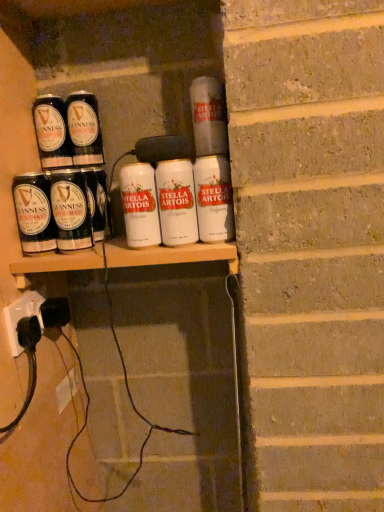
At what (x,y) coordinates should I click in order to perform the action: click on white matte tin can at upper center, the second tin can viewed from the right. Please return your answer as a coordinate pair (x, y). This screenshot has width=384, height=512. Looking at the image, I should click on (208, 116).

What do you see at coordinates (84, 129) in the screenshot?
I see `shiny black can at left, positioned as the 5th tin can in right-to-left order` at bounding box center [84, 129].

Find the location of a particular element. matte black can at left, the 7th tin can viewed from the right is located at coordinates (34, 212).

The height and width of the screenshot is (512, 384). I want to click on white plastic socket at lower left, so click(21, 316).

This screenshot has height=512, width=384. I want to click on white matte stella artois can at center, which is the 6th tin can in left-to-right order, so click(176, 202).

From the picture: Considering the sizes of objects white matte stella artois can at center, which is the 6th tin can in left-to-right order, and white matte tin can at upper center, the second tin can viewed from the right, in the image provided, who is smaller, white matte stella artois can at center, which is the 6th tin can in left-to-right order, or white matte tin can at upper center, the second tin can viewed from the right,?

With smaller size is white matte tin can at upper center, the second tin can viewed from the right.

Is white matte stella artois can at center, which is the 6th tin can in left-to-right order, in contact with white matte tin can at upper center, the second tin can viewed from the right?

white matte stella artois can at center, which is the 6th tin can in left-to-right order, is not next to white matte tin can at upper center, the second tin can viewed from the right, and they're not touching.

Is point (193, 199) closer to viewer compared to point (224, 137)?

That is False.

Is white matte stella artois can at center, which is the 6th tin can in left-to-right order, to the left or to the right of white matte tin can at upper center, the second tin can viewed from the right, in the image?

From the image, it's evident that white matte stella artois can at center, which is the 6th tin can in left-to-right order, is to the left of white matte tin can at upper center, the second tin can viewed from the right.

Does point (144, 166) appear closer or farther from the camera than point (195, 96)?

Point (144, 166) appears to be closer to the viewer than point (195, 96).

Is white matte tin can at center, which ranks as the fourth tin can in right-to-left order, not close to white matte tin can at upper center, the seventh tin can positioned from the left?

Actually, white matte tin can at center, which ranks as the fourth tin can in right-to-left order, and white matte tin can at upper center, the seventh tin can positioned from the left, are a little close together.

From a real-world perspective, who is located lower, white matte tin can at center, the fifth tin can when ordered from left to right, or white matte tin can at upper center, the second tin can viewed from the right?

white matte tin can at center, the fifth tin can when ordered from left to right, from a real-world perspective.

From the image's perspective, who appears lower, white matte tin can at center, which ranks as the fourth tin can in right-to-left order, or white matte tin can at upper center, the seventh tin can positioned from the left?

white matte tin can at center, which ranks as the fourth tin can in right-to-left order, from the image's perspective.

From the image's perspective, which tin can is the 1st one above the white plastic socket at lower left? Please provide its 2D coordinates.

[(34, 212)]

Are white plastic socket at lower left and matte black can at left, the 7th tin can viewed from the right, far apart?

No, white plastic socket at lower left is in close proximity to matte black can at left, the 7th tin can viewed from the right.

Is white plastic socket at lower left at the left side of matte black can at left, the 7th tin can viewed from the right?

Yes, white plastic socket at lower left is to the left of matte black can at left, the 7th tin can viewed from the right.

Is white plastic socket at lower left smaller than matte black can at left, the second tin can in the left-to-right sequence?

Indeed, white plastic socket at lower left has a smaller size compared to matte black can at left, the second tin can in the left-to-right sequence.

What's the angular difference between white matte tin can at upper center, the second tin can viewed from the right, and white matte tin can at center, which ranks as the fourth tin can in right-to-left order,'s facing directions?

0.000648 degrees separate the facing orientations of white matte tin can at upper center, the second tin can viewed from the right, and white matte tin can at center, which ranks as the fourth tin can in right-to-left order.

Is white matte tin can at upper center, the second tin can viewed from the right, directly adjacent to white matte tin can at center, which ranks as the fourth tin can in right-to-left order?

No, white matte tin can at upper center, the second tin can viewed from the right, is not next to white matte tin can at center, which ranks as the fourth tin can in right-to-left order.

Is point (221, 86) closer to viewer compared to point (139, 232)?

That is False.

From the image's perspective, which is below, white matte tin can at upper center, the seventh tin can positioned from the left, or white matte tin can at center, which ranks as the fourth tin can in right-to-left order?

white matte tin can at center, which ranks as the fourth tin can in right-to-left order.

Choose the correct answer: Is white matte stella artois can at center, the eighth tin can when ordered from left to right, inside white plastic socket at lower left or outside it?

white matte stella artois can at center, the eighth tin can when ordered from left to right, lies outside white plastic socket at lower left.

From the picture: Which point is more forward, (232, 202) or (38, 315)?

The point (232, 202) is closer.

Is white matte stella artois can at center, the 1th tin can positioned from the right, next to white plastic socket at lower left and touching it?

No.

Is white matte stella artois can at center, the 1th tin can positioned from the right, in front of or behind white plastic socket at lower left in the image?

white matte stella artois can at center, the 1th tin can positioned from the right, is in front of white plastic socket at lower left.

Between matte black can at left, the 6th tin can when ordered from right to left, and shiny black can at left, positioned as the 5th tin can in right-to-left order, which one has more height?

With more height is shiny black can at left, positioned as the 5th tin can in right-to-left order.

From the image's perspective, relative to shiny black can at left, placed as the fourth tin can when sorted from left to right, is matte black can at left, the 6th tin can when ordered from right to left, above or below?

matte black can at left, the 6th tin can when ordered from right to left, is situated lower than shiny black can at left, placed as the fourth tin can when sorted from left to right, in the image.

Is matte black can at left, which is the 3th tin can in left-to-right order, closer to camera compared to shiny black can at left, positioned as the 5th tin can in right-to-left order?

Yes, it is in front of shiny black can at left, positioned as the 5th tin can in right-to-left order.

Between matte black can at left, which is the 3th tin can in left-to-right order, and shiny black can at left, positioned as the 5th tin can in right-to-left order, which one has larger width?

With larger width is shiny black can at left, positioned as the 5th tin can in right-to-left order.

Which is closer, (201, 201) or (28, 173)?

Point (201, 201) is closer to the camera than point (28, 173).

From a real-world perspective, is white matte stella artois can at center, the 1th tin can positioned from the right, below matte black can at left, the 7th tin can viewed from the right?

Yes, from a real-world perspective, white matte stella artois can at center, the 1th tin can positioned from the right, is below matte black can at left, the 7th tin can viewed from the right.

Between white matte stella artois can at center, the eighth tin can when ordered from left to right, and matte black can at left, the 7th tin can viewed from the right, which one is positioned behind?

matte black can at left, the 7th tin can viewed from the right, is more distant.

From the image's perspective, which is below, white matte stella artois can at center, the eighth tin can when ordered from left to right, or matte black can at left, the second tin can in the left-to-right sequence?

matte black can at left, the second tin can in the left-to-right sequence, from the image's perspective.

From the white matte stella artois can at center, which ranks as the 3th tin can in right-to-left order, count 1st tin can to the right and point to it. Please provide its 2D coordinates.

[(208, 116)]

Where is `the 3rd tin can in front of the white matte tin can at center, the fifth tin can when ordered from left to right, counting from the anchor's position`? The width and height of the screenshot is (384, 512). the 3rd tin can in front of the white matte tin can at center, the fifth tin can when ordered from left to right, counting from the anchor's position is located at coordinates (208, 116).

When comparing their distances from shiny black can at left, placed as the fourth tin can when sorted from left to right, does matte black can at left, which is the 3th tin can in left-to-right order, or matte black guinness can at upper left, arranged as the 1th tin can when viewed from the left, seem further?

matte black can at left, which is the 3th tin can in left-to-right order, lies further to shiny black can at left, placed as the fourth tin can when sorted from left to right, than the other object.

Based on their spatial positions, is white plastic socket at lower left or shiny black can at left, placed as the fourth tin can when sorted from left to right, closer to matte black can at left, which is the 3th tin can in left-to-right order?

Based on the image, shiny black can at left, placed as the fourth tin can when sorted from left to right, appears to be nearer to matte black can at left, which is the 3th tin can in left-to-right order.

Based on their spatial positions, is shiny black can at left, positioned as the 5th tin can in right-to-left order, or matte black can at left, the second tin can in the left-to-right sequence, further from white matte stella artois can at center, which is the 6th tin can in left-to-right order?

The object further to white matte stella artois can at center, which is the 6th tin can in left-to-right order, is shiny black can at left, positioned as the 5th tin can in right-to-left order.

Looking at the image, which one is located further to matte black can at left, the second tin can in the left-to-right sequence, white matte stella artois can at center, the 1th tin can positioned from the right, or white matte stella artois can at center, which ranks as the 3th tin can in right-to-left order?

Among the two, white matte stella artois can at center, the 1th tin can positioned from the right, is located further to matte black can at left, the second tin can in the left-to-right sequence.

Considering their positions, is white plastic socket at lower left positioned further to white matte tin can at upper center, the second tin can viewed from the right, than white matte tin can at center, the fifth tin can when ordered from left to right?

Based on the image, white plastic socket at lower left appears to be further to white matte tin can at upper center, the second tin can viewed from the right.

From the picture: Based on their spatial positions, is white plastic socket at lower left or white matte tin can at upper center, the seventh tin can positioned from the left, further from shiny black can at left, placed as the fourth tin can when sorted from left to right?

The object further to shiny black can at left, placed as the fourth tin can when sorted from left to right, is white plastic socket at lower left.

Considering their positions, is shiny black can at left, placed as the fourth tin can when sorted from left to right, positioned further to white plastic socket at lower left than matte black guinness can at upper left, arranged as the 1th tin can when viewed from the left?

The object further to white plastic socket at lower left is shiny black can at left, placed as the fourth tin can when sorted from left to right.

Which object lies further to the anchor point white plastic socket at lower left, white matte tin can at center, the fifth tin can when ordered from left to right, or matte black can at left, which is the 3th tin can in left-to-right order?

white matte tin can at center, the fifth tin can when ordered from left to right, lies further to white plastic socket at lower left than the other object.

At what (x,y) coordinates should I click in order to perform the action: click on tin can between white matte tin can at upper center, the seventh tin can positioned from the left, and white matte stella artois can at center, which ranks as the 3th tin can in right-to-left order, in the vertical direction. Please return your answer as a coordinate pair (x, y). This screenshot has height=512, width=384. Looking at the image, I should click on click(x=214, y=199).

Find the location of `tin can that lies between matte black can at left, the 6th tin can when ordered from right to left, and white plastic socket at lower left from top to bottom`. tin can that lies between matte black can at left, the 6th tin can when ordered from right to left, and white plastic socket at lower left from top to bottom is located at coordinates (34, 212).